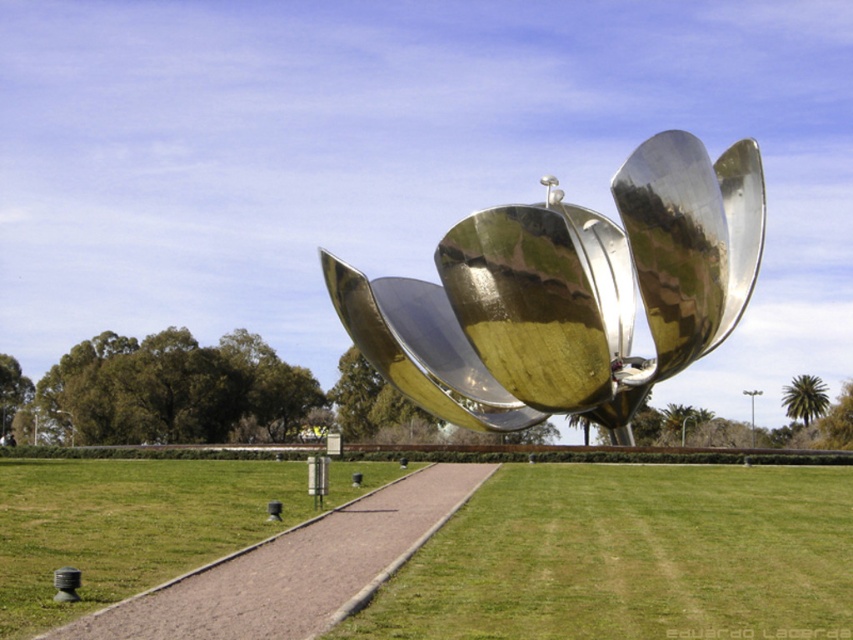
Who is more forward, (543, 387) or (735, 556)?

Point (735, 556) is in front.

What do you see at coordinates (569, 292) in the screenshot? I see `shiny metallic flower at center` at bounding box center [569, 292].

This screenshot has height=640, width=853. What are the coordinates of `shiny metallic flower at center` in the screenshot? It's located at (569, 292).

Can you confirm if green grass at center is bigger than paved stone path at center?

Indeed, green grass at center has a larger size compared to paved stone path at center.

Is point (735, 532) in front of point (194, 605)?

No, (735, 532) is behind (194, 605).

Who is more distant from viewer, (763, 470) or (209, 586)?

The point (763, 470) is behind.

You are a GUI agent. You are given a task and a screenshot of the screen. Output one action in this format:
    pyautogui.click(x=<x>, y=<y>)
    Task: Click on the green grass at center
    The image size is (853, 640).
    Given the screenshot: What is the action you would take?
    pyautogui.click(x=630, y=557)

Is shiny metallic flower at center shorter than paved stone path at center?

No.

Can you confirm if shiny metallic flower at center is smaller than paved stone path at center?

Incorrect, shiny metallic flower at center is not smaller in size than paved stone path at center.

Find the location of `shiny metallic flower at center`. shiny metallic flower at center is located at coordinates (569, 292).

Locate an element on the screen. shiny metallic flower at center is located at coordinates (569, 292).